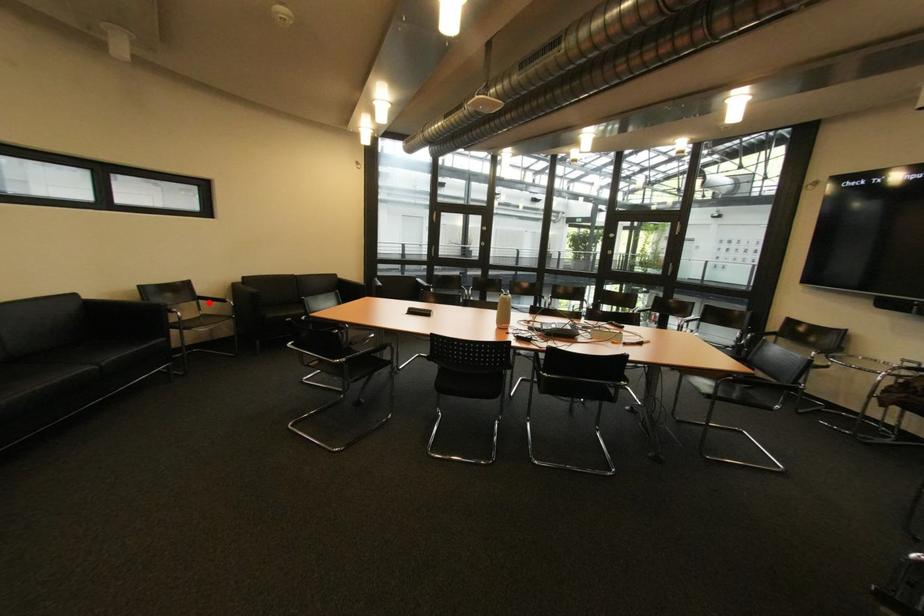
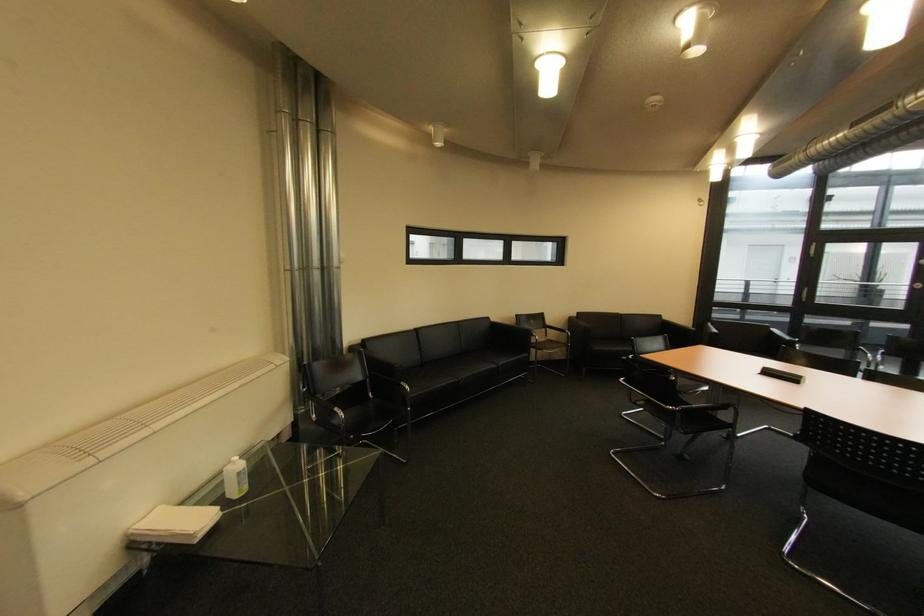
Question: I am providing you with two images of the same scene from different viewpoints. Given a red point in image1, look at the same physical point in image2. Is it:

Choices:
 (A) Closer to the viewpoint
 (B) Farther from the viewpoint

Answer: (A)